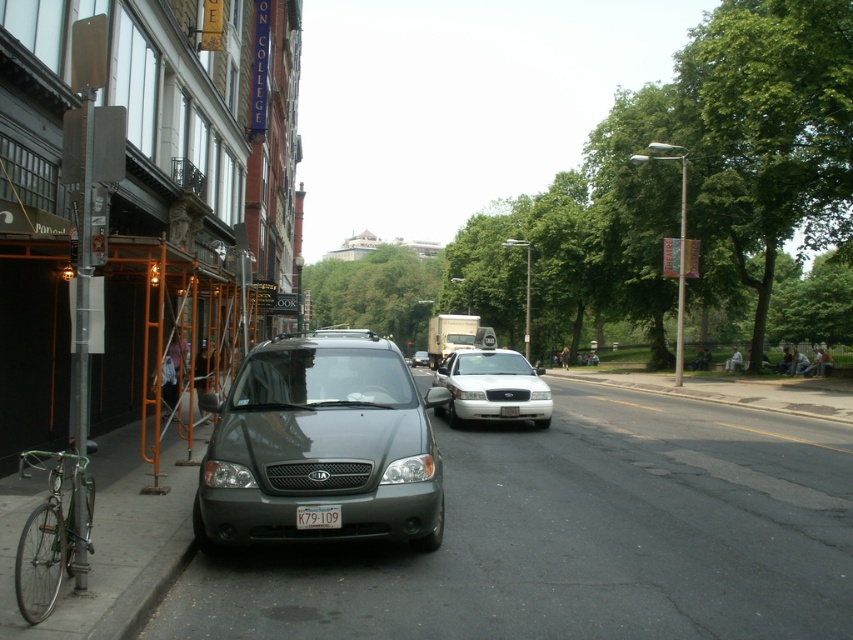
Looking at this image, you are a pedestrian standing on the sidewalk and want to cross the street. You see a white glossy taxi at center and a silver metallic minivan at center. Which vehicle should you wait for to pass before crossing?

The white glossy taxi at center is closer to the viewer than the silver metallic minivan at center, so you should wait for the white glossy taxi at center to pass first before crossing the street.